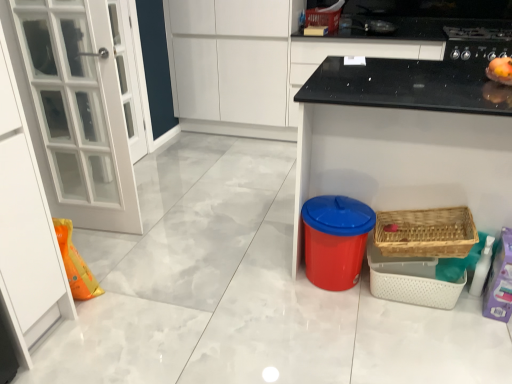
This screenshot has width=512, height=384. Describe the element at coordinates (335, 240) in the screenshot. I see `red plastic trash can at lower center, the first appliance when ordered from left to right` at that location.

At what (x,y) coordinates should I click in order to perform the action: click on woven wood basket at lower right, positioned as the first basket in bottom-to-top order. Please return your answer as a coordinate pair (x, y). Looking at the image, I should click on (426, 232).

The width and height of the screenshot is (512, 384). Find the location of `white matte cabinet at upper center`. white matte cabinet at upper center is located at coordinates (230, 59).

Where is `wooden wicker basket at upper right, which is counted as the first basket, starting from the top`? The height and width of the screenshot is (384, 512). wooden wicker basket at upper right, which is counted as the first basket, starting from the top is located at coordinates (323, 18).

What do you see at coordinates (477, 43) in the screenshot? I see `black glossy stove at upper right, positioned as the first appliance in top-to-bottom order` at bounding box center [477, 43].

This screenshot has height=384, width=512. I want to click on red plastic trash can at lower center, the first appliance when ordered from left to right, so click(335, 240).

Is woven wood basket at lower right, positioned as the first basket in bottom-to-top order, bigger than white matte cabinet at upper center?

No, woven wood basket at lower right, positioned as the first basket in bottom-to-top order, is not bigger than white matte cabinet at upper center.

Which object is further away from the camera taking this photo, woven wood basket at lower right, positioned as the second basket in top-to-bottom order, or white matte cabinet at upper center?

white matte cabinet at upper center is further away from the camera.

From the image's perspective, between woven wood basket at lower right, positioned as the first basket in bottom-to-top order, and white matte cabinet at upper center, which one is located above?

white matte cabinet at upper center is shown above in the image.

Which point is more forward, (x=228, y=78) or (x=449, y=53)?

The point (x=449, y=53) is closer to the camera.

Which is correct: white matte cabinet at upper center is inside black glossy stove at upper right, positioned as the first appliance in top-to-bottom order, or outside of it?

The correct answer is: outside.

At what (x,y) coordinates should I click in order to perform the action: click on appliance above the white matte cabinet at upper center (from a real-world perspective). Please return your answer as a coordinate pair (x, y). Looking at the image, I should click on (477, 43).

Is white matte cabinet at upper center bigger or smaller than red plastic trash can at lower center, positioned as the 2th appliance in back-to-front order?

Considering their sizes, white matte cabinet at upper center takes up more space than red plastic trash can at lower center, positioned as the 2th appliance in back-to-front order.

Is white matte cabinet at upper center far away from red plastic trash can at lower center, arranged as the second appliance when viewed from the right?

Absolutely, white matte cabinet at upper center is distant from red plastic trash can at lower center, arranged as the second appliance when viewed from the right.

Considering the points (179, 27) and (328, 245), which point is in front, point (179, 27) or point (328, 245)?

Point (328, 245)

Is white matte cabinet at upper center turned away from red plastic trash can at lower center, placed as the 2th appliance when sorted from top to bottom?

No, white matte cabinet at upper center is not facing the opposite direction of red plastic trash can at lower center, placed as the 2th appliance when sorted from top to bottom.

Consider the image. Looking at their sizes, would you say blue plastic bin at lower right is wider or thinner than woven wood basket at lower right, which is counted as the first basket, starting from the front?

Clearly, blue plastic bin at lower right has more width compared to woven wood basket at lower right, which is counted as the first basket, starting from the front.

Consider the image. What's the angular difference between blue plastic bin at lower right and woven wood basket at lower right, which is counted as the first basket, starting from the front,'s facing directions?

blue plastic bin at lower right and woven wood basket at lower right, which is counted as the first basket, starting from the front, are facing 1.53 degrees away from each other.

Can woven wood basket at lower right, the second basket when ordered from back to front, be found inside blue plastic bin at lower right?

That's correct, woven wood basket at lower right, the second basket when ordered from back to front, is inside blue plastic bin at lower right.

Could you tell me if blue plastic bin at lower right is turned towards woven wood basket at lower right, positioned as the second basket in top-to-bottom order?

Yes.

Is blue plastic bin at lower right to the left or to the right of wooden wicker basket at upper right, acting as the second basket starting from the front, in the image?

From the image, it's evident that blue plastic bin at lower right is to the right of wooden wicker basket at upper right, acting as the second basket starting from the front.

Considering the positions of point (393, 85) and point (338, 23), is point (393, 85) closer or farther from the camera than point (338, 23)?

Point (393, 85) is positioned closer to the camera compared to point (338, 23).

From the image's perspective, is blue plastic bin at lower right below wooden wicker basket at upper right, the 1th basket in the back-to-front sequence?

Correct, blue plastic bin at lower right appears lower than wooden wicker basket at upper right, the 1th basket in the back-to-front sequence, in the image.

In the scene shown: Is blue plastic bin at lower right aimed at wooden wicker basket at upper right, which is counted as the first basket, starting from the top?

No, blue plastic bin at lower right is not oriented towards wooden wicker basket at upper right, which is counted as the first basket, starting from the top.

Is black glossy stove at upper right, which ranks as the 2th appliance in left-to-right order, smaller than red plastic trash can at lower center, which is counted as the 1th appliance, starting from the front?

Actually, black glossy stove at upper right, which ranks as the 2th appliance in left-to-right order, might be larger than red plastic trash can at lower center, which is counted as the 1th appliance, starting from the front.

Is black glossy stove at upper right, which ranks as the 2th appliance in left-to-right order, placed right next to red plastic trash can at lower center, the first appliance when ordered from left to right?

No.

From a real-world perspective, is black glossy stove at upper right, the 1th appliance from the back, physically located above or below red plastic trash can at lower center, which ranks as the first appliance in bottom-to-top order?

From a real-world perspective, black glossy stove at upper right, the 1th appliance from the back, is physically above red plastic trash can at lower center, which ranks as the first appliance in bottom-to-top order.

Does black glossy stove at upper right, the 1th appliance from the back, have a greater height compared to red plastic trash can at lower center, arranged as the second appliance when viewed from the right?

No.

Consider the image. Is black glossy stove at upper right, positioned as the 2th appliance in bottom-to-top order, not near white matte cabinet at upper center?

Yes, black glossy stove at upper right, positioned as the 2th appliance in bottom-to-top order, is far from white matte cabinet at upper center.

Does black glossy stove at upper right, positioned as the second appliance in front-to-back order, come behind white matte cabinet at upper center?

No, it is not.

Find the location of `cabinetry to the left of black glossy stove at upper right, which ranks as the 2th appliance in left-to-right order`. cabinetry to the left of black glossy stove at upper right, which ranks as the 2th appliance in left-to-right order is located at coordinates (230, 59).

At what (x,y) coordinates should I click in order to perform the action: click on cabinetry that appears on the left of woven wood basket at lower right, which is counted as the first basket, starting from the front. Please return your answer as a coordinate pair (x, y). The width and height of the screenshot is (512, 384). Looking at the image, I should click on (230, 59).

I want to click on appliance that is the 2nd object to the right of the white matte cabinet at upper center, starting at the anchor, so click(477, 43).

Based on the photo, estimate the real-world distances between objects in this image. Which object is closer to black glossy stove at upper right, positioned as the 2th appliance in bottom-to-top order, woven wood basket at lower right, positioned as the first basket in bottom-to-top order, or red plastic trash can at lower center, which is counted as the 1th appliance, starting from the front?

Among the two, woven wood basket at lower right, positioned as the first basket in bottom-to-top order, is located nearer to black glossy stove at upper right, positioned as the 2th appliance in bottom-to-top order.

When comparing their distances from wooden wicker basket at upper right, the 1th basket in the back-to-front sequence, does blue plastic bin at lower right or woven wood basket at lower right, positioned as the first basket in bottom-to-top order, seem closer?

The object closer to wooden wicker basket at upper right, the 1th basket in the back-to-front sequence, is blue plastic bin at lower right.

Based on the photo, when comparing their distances from wooden wicker basket at upper right, acting as the second basket starting from the front, does woven wood basket at lower right, the second basket when ordered from back to front, or white matte cabinet at upper center seem further?

woven wood basket at lower right, the second basket when ordered from back to front, lies further to wooden wicker basket at upper right, acting as the second basket starting from the front, than the other object.

When comparing their distances from white matte cabinet at upper center, does black glossy stove at upper right, which ranks as the 1th appliance in right-to-left order, or wooden wicker basket at upper right, placed as the 2th basket when sorted from bottom to top, seem closer?

wooden wicker basket at upper right, placed as the 2th basket when sorted from bottom to top, is positioned closer to the anchor white matte cabinet at upper center.

Looking at the image, which one is located further to white matte cabinet at upper center, woven wood basket at lower right, positioned as the second basket in top-to-bottom order, or black glossy stove at upper right, the 1th appliance from the back?

woven wood basket at lower right, positioned as the second basket in top-to-bottom order, is further to white matte cabinet at upper center.

Which object lies nearer to the anchor point red plastic trash can at lower center, placed as the 2th appliance when sorted from top to bottom, woven wood basket at lower right, positioned as the first basket in bottom-to-top order, or wooden wicker basket at upper right, which is counted as the first basket, starting from the top?

Among the two, woven wood basket at lower right, positioned as the first basket in bottom-to-top order, is located nearer to red plastic trash can at lower center, placed as the 2th appliance when sorted from top to bottom.

Estimate the real-world distances between objects in this image. Which object is further from wooden wicker basket at upper right, placed as the 2th basket when sorted from bottom to top, woven wood basket at lower right, which is counted as the first basket, starting from the front, or black glossy stove at upper right, which ranks as the 1th appliance in right-to-left order?

woven wood basket at lower right, which is counted as the first basket, starting from the front, is further to wooden wicker basket at upper right, placed as the 2th basket when sorted from bottom to top.

Which object lies further to the anchor point red plastic trash can at lower center, the first appliance when ordered from left to right, woven wood basket at lower right, positioned as the first basket in bottom-to-top order, or white matte cabinet at upper center?

Based on the image, white matte cabinet at upper center appears to be further to red plastic trash can at lower center, the first appliance when ordered from left to right.

At what (x,y) coordinates should I click in order to perform the action: click on appliance between wooden wicker basket at upper right, placed as the 2th basket when sorted from bottom to top, and woven wood basket at lower right, positioned as the first basket in bottom-to-top order, from top to bottom. Please return your answer as a coordinate pair (x, y). Looking at the image, I should click on (477, 43).

This screenshot has width=512, height=384. What are the coordinates of `appliance between white matte cabinet at upper center and black glossy stove at upper right, which ranks as the 1th appliance in right-to-left order, in the horizontal direction` in the screenshot? It's located at (335, 240).

Locate an element on the screen. Image resolution: width=512 pixels, height=384 pixels. basket between black glossy stove at upper right, positioned as the second appliance in front-to-back order, and red plastic trash can at lower center, which ranks as the first appliance in bottom-to-top order, in the vertical direction is located at coordinates pos(426,232).

In order to click on cabinetry between blue plastic bin at lower right and wooden wicker basket at upper right, which is counted as the first basket, starting from the top, in the front-back direction in this screenshot , I will do `click(230, 59)`.